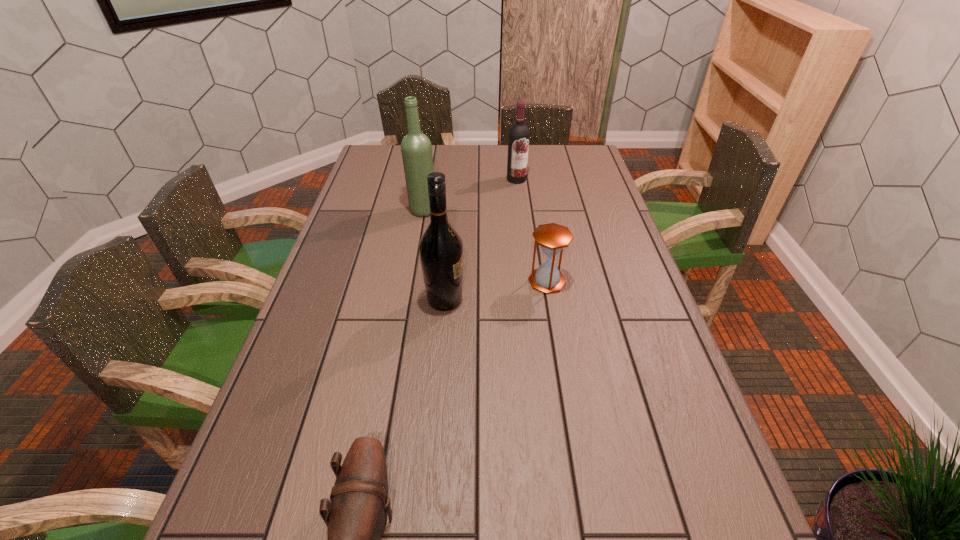
Locate an element on the screen. object identified as the closest to the shortest wine bottle is located at coordinates (416, 148).

Find the location of a particular element. This screenshot has width=960, height=540. object that is the third nearest to the rightmost wine bottle is located at coordinates (441, 248).

In order to click on the second closest wine bottle relative to the pouch in this screenshot , I will do `click(416, 148)`.

Select which wine bottle is the closest to the pouch. Please provide its 2D coordinates. Your answer should be formatted as a tuple, i.e. [(x, y)], where the tuple contains the x and y coordinates of a point satisfying the conditions above.

[(441, 248)]

You are a GUI agent. You are given a task and a screenshot of the screen. Output one action in this format:
    pyautogui.click(x=<x>, y=<y>)
    Task: Click on the free location that satisfies the following two spatial constraints: 1. on the label of the third shortest object; 2. on the label of the nearest wine bottle
    The image size is (960, 540).
    Given the screenshot: What is the action you would take?
    pyautogui.click(x=531, y=300)

This screenshot has width=960, height=540. Identify the location of vacant space that satisfies the following two spatial constraints: 1. on the label of the farthest object; 2. on the label of the nearest wine bottle. (531, 300).

I want to click on free space that satisfies the following two spatial constraints: 1. on the label of the hourglass; 2. on the right side of the rightmost wine bottle, so click(529, 281).

I want to click on vacant space that satisfies the following two spatial constraints: 1. on the label of the third shortest object; 2. on the label of the nearest wine bottle, so click(531, 300).